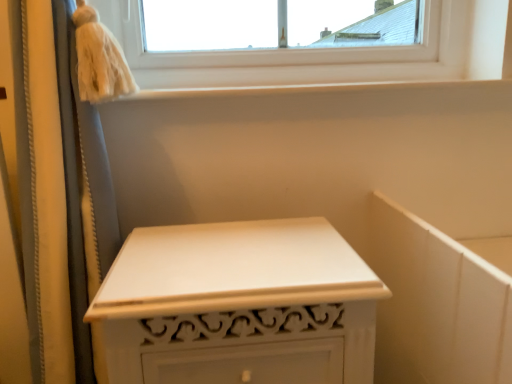
What is the approximate width of white smooth window sill at upper center?

The width of white smooth window sill at upper center is 19.10 centimeters.

Where is `white smooth window sill at upper center`? This screenshot has height=384, width=512. white smooth window sill at upper center is located at coordinates (328, 90).

The height and width of the screenshot is (384, 512). What do you see at coordinates (328, 90) in the screenshot?
I see `white smooth window sill at upper center` at bounding box center [328, 90].

Where is `white painted wood nightstand at center`? The height and width of the screenshot is (384, 512). white painted wood nightstand at center is located at coordinates (239, 305).

What do you see at coordinates (239, 305) in the screenshot? I see `white painted wood nightstand at center` at bounding box center [239, 305].

The height and width of the screenshot is (384, 512). Find the location of `white smooth window sill at upper center`. white smooth window sill at upper center is located at coordinates (x=328, y=90).

Is white painted wood nightstand at center to the left or to the right of white smooth window sill at upper center in the image?

white painted wood nightstand at center is positioned on white smooth window sill at upper center's left side.

Is white painted wood nightstand at center behind white smooth window sill at upper center?

No.

Which point is more forward, (328, 285) or (210, 89)?

The point (328, 285) is more forward.

From the image's perspective, which is above, white painted wood nightstand at center or white smooth window sill at upper center?

white smooth window sill at upper center.

From a real-world perspective, is white painted wood nightstand at center located higher than white smooth window sill at upper center?

No, from a real-world perspective, white painted wood nightstand at center is not over white smooth window sill at upper center

Considering the relative sizes of white painted wood nightstand at center and white smooth window sill at upper center in the image provided, is white painted wood nightstand at center wider than white smooth window sill at upper center?

Indeed, white painted wood nightstand at center has a greater width compared to white smooth window sill at upper center.

Can you confirm if white painted wood nightstand at center is taller than white smooth window sill at upper center?

Yes.

Which of these two, white painted wood nightstand at center or white smooth window sill at upper center, is smaller?

white smooth window sill at upper center is smaller.

Is white painted wood nightstand at center inside or outside of white smooth window sill at upper center?

white painted wood nightstand at center is outside white smooth window sill at upper center.

Are white painted wood nightstand at center and white smooth window sill at upper center located far from each other?

They are positioned close to each other.

Is white smooth window sill at upper center at the back of white painted wood nightstand at center?

No, white smooth window sill at upper center is not at the back of white painted wood nightstand at center.

Measure the distance between white painted wood nightstand at center and white smooth window sill at upper center.

white painted wood nightstand at center and white smooth window sill at upper center are 16.29 inches apart.

The height and width of the screenshot is (384, 512). Identify the location of window sill positioned vertically above the white painted wood nightstand at center (from a real-world perspective). (328, 90).

Would you say white smooth window sill at upper center is to the left or to the right of white painted wood nightstand at center in the picture?

white smooth window sill at upper center is to the right of white painted wood nightstand at center.

Who is more distant, white smooth window sill at upper center or white painted wood nightstand at center?

Positioned behind is white smooth window sill at upper center.

Considering the points (110, 104) and (331, 269), which point is in front, point (110, 104) or point (331, 269)?

Point (331, 269)

From the image's perspective, is white smooth window sill at upper center positioned above or below white painted wood nightstand at center?

Based on their image positions, white smooth window sill at upper center is located above white painted wood nightstand at center.

From a real-world perspective, is white smooth window sill at upper center located beneath white painted wood nightstand at center?

No.

Considering the sizes of objects white smooth window sill at upper center and white painted wood nightstand at center in the image provided, who is thinner, white smooth window sill at upper center or white painted wood nightstand at center?

With smaller width is white smooth window sill at upper center.

Can you confirm if white smooth window sill at upper center is taller than white painted wood nightstand at center?

No, white smooth window sill at upper center is not taller than white painted wood nightstand at center.

Is white smooth window sill at upper center bigger or smaller than white painted wood nightstand at center?

In the image, white smooth window sill at upper center appears to be smaller than white painted wood nightstand at center.

Is white painted wood nightstand at center a part of white smooth window sill at upper center?

No, white painted wood nightstand at center is not surrounded by white smooth window sill at upper center.

Are white smooth window sill at upper center and white painted wood nightstand at center beside each other?

No, white smooth window sill at upper center is not touching white painted wood nightstand at center.

Is white smooth window sill at upper center oriented away from white painted wood nightstand at center?

white smooth window sill at upper center does not have its back to white painted wood nightstand at center.

How much distance is there between white smooth window sill at upper center and white painted wood nightstand at center?

white smooth window sill at upper center is 16.29 inches from white painted wood nightstand at center.

Locate an element on the screen. Image resolution: width=512 pixels, height=384 pixels. furniture located below the white smooth window sill at upper center (from the image's perspective) is located at coordinates (239, 305).

Where is `window sill above the white painted wood nightstand at center (from a real-world perspective)`? This screenshot has width=512, height=384. window sill above the white painted wood nightstand at center (from a real-world perspective) is located at coordinates (328, 90).

The height and width of the screenshot is (384, 512). In order to click on window sill on the right of white painted wood nightstand at center in this screenshot , I will do `click(328, 90)`.